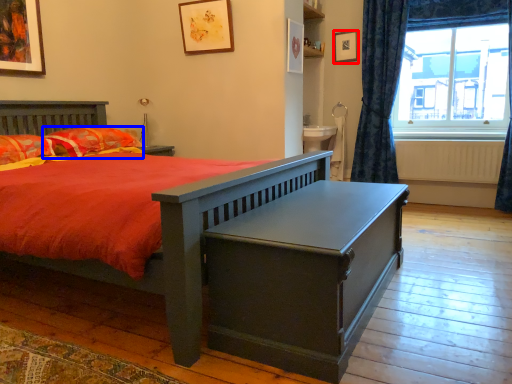
Question: Among these objects, which one is nearest to the camera, picture frame (highlighted by a red box) or pillow (highlighted by a blue box)?

Choices:
 (A) picture frame
 (B) pillow

Answer: (B)